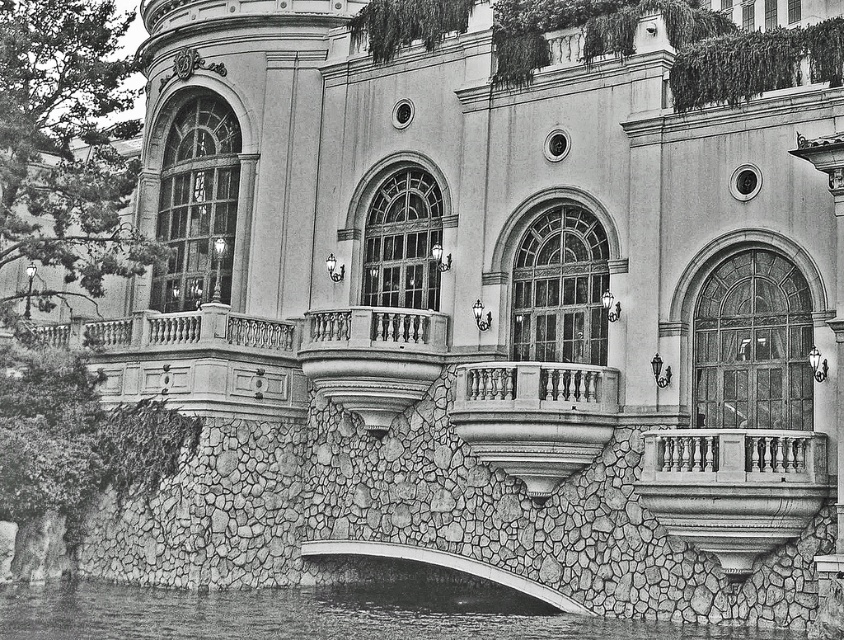
Question: Is clear water at lower center below white stone bridge at center?

Choices:
 (A) yes
 (B) no

Answer: (A)

Question: Considering the real-world distances, which object is farthest from the white stone bridge at center?

Choices:
 (A) clear water at lower center
 (B) smooth stone balcony at center

Answer: (B)

Question: Which of the following is the closest to the observer?

Choices:
 (A) smooth stone balcony at center
 (B) white stone bridge at center

Answer: (A)

Question: Does clear water at lower center appear on the right side of white stone bridge at center?

Choices:
 (A) yes
 (B) no

Answer: (B)

Question: Does clear water at lower center appear on the right side of white stone bridge at center?

Choices:
 (A) no
 (B) yes

Answer: (A)

Question: Which point is closer to the camera?

Choices:
 (A) smooth stone balcony at center
 (B) white stone bridge at center
 (C) clear water at lower center

Answer: (C)